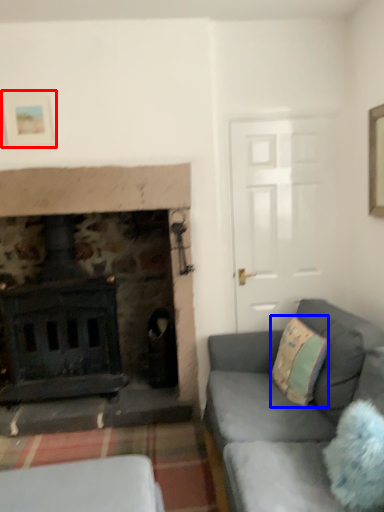
Question: Which object appears farthest to the camera in this image, picture frame (highlighted by a red box) or throw pillow (highlighted by a blue box)?

Choices:
 (A) picture frame
 (B) throw pillow

Answer: (A)